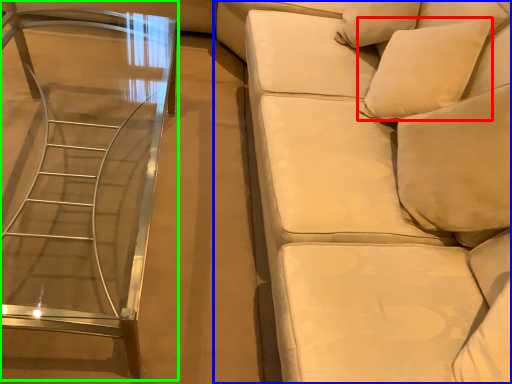
Question: Which object is the closest to the pillow (highlighted by a red box)? Choose among these: studio couch (highlighted by a blue box) or table (highlighted by a green box).

Choices:
 (A) studio couch
 (B) table

Answer: (A)